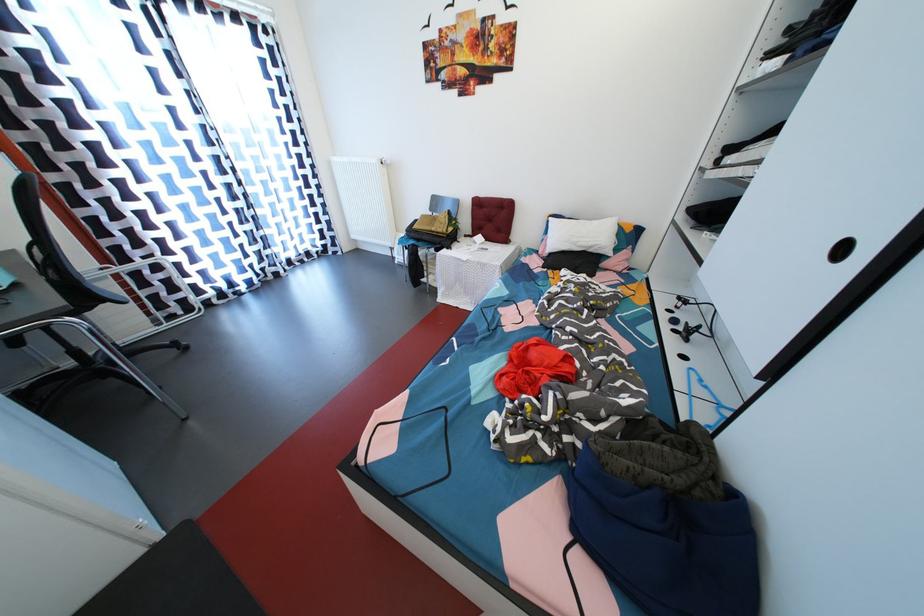
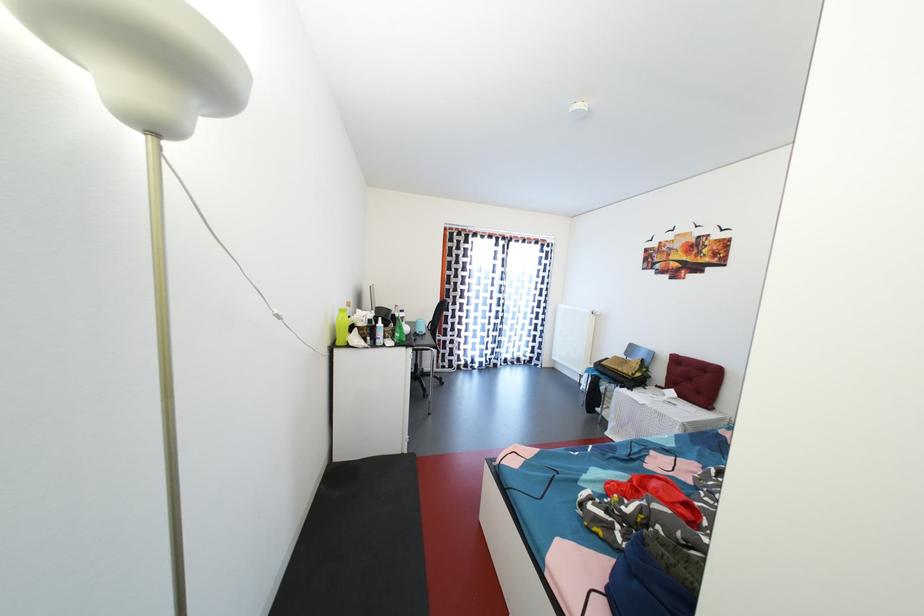
Find the pixel in the second image that matches point (489, 200) in the first image.

(688, 359)